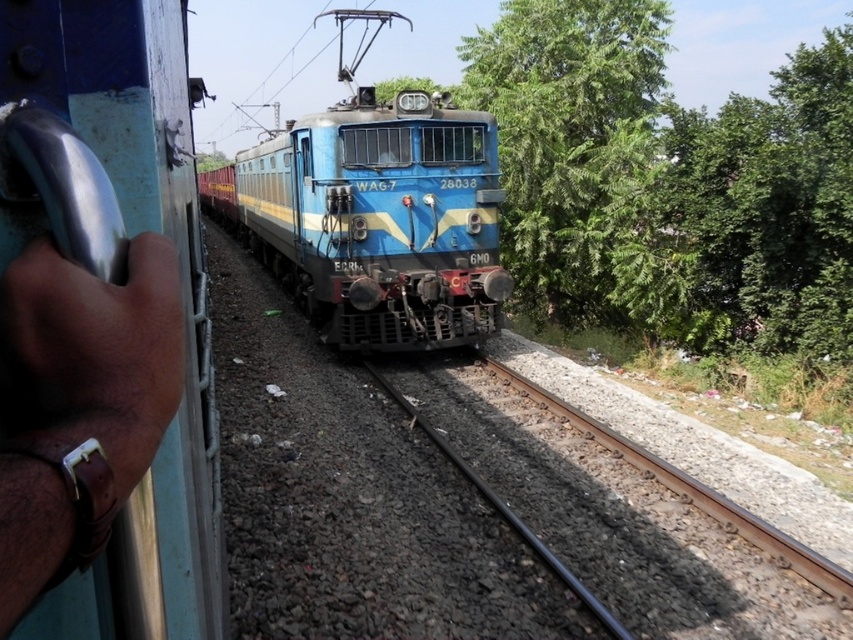
Who is positioned more to the left, blue glossy train at center or brown leather wristwatch at left?

blue glossy train at center

Is point (318, 308) in front of point (172, 256)?

That is False.

Which is in front, point (463, 168) or point (67, 273)?

Point (67, 273) is in front.

At what (x,y) coordinates should I click in order to perform the action: click on blue glossy train at center. Please return your answer as a coordinate pair (x, y). The image size is (853, 640). Looking at the image, I should click on (376, 218).

Is black asphalt track at center further to the viewer compared to brown leather wristwatch at left?

Yes, it is behind brown leather wristwatch at left.

Who is lower down, black asphalt track at center or brown leather wristwatch at left?

Answer: black asphalt track at center is lower down.

Identify the location of black asphalt track at center. Image resolution: width=853 pixels, height=640 pixels. (618, 513).

Is green leafy tree at center wider than black asphalt track at center?

Indeed, green leafy tree at center has a greater width compared to black asphalt track at center.

From the picture: Does green leafy tree at center have a greater height compared to black asphalt track at center?

Yes, green leafy tree at center is taller than black asphalt track at center.

Image resolution: width=853 pixels, height=640 pixels. Identify the location of green leafy tree at center. (668, 182).

Locate an element on the screen. green leafy tree at center is located at coordinates (668, 182).